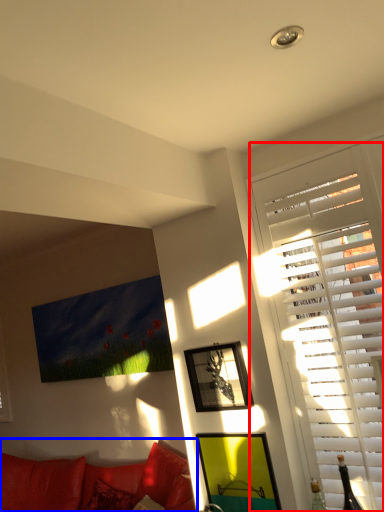
Question: Which point is further to the camera, window (highlighted by a red box) or studio couch (highlighted by a blue box)?

Choices:
 (A) window
 (B) studio couch

Answer: (B)